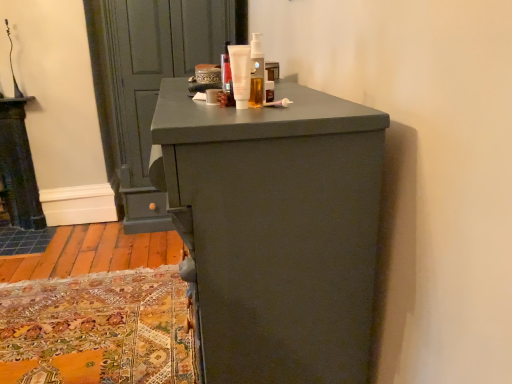
Question: Is point (239, 46) closer or farther from the camera than point (211, 99)?

Choices:
 (A) farther
 (B) closer

Answer: (B)

Question: Is white matte tube at center, positioned as the 2th toiletry in right-to-left order, inside or outside of matte white cream at center, which is counted as the first toiletry, starting from the left?

Choices:
 (A) outside
 (B) inside

Answer: (A)

Question: Estimate the real-world distances between objects in this image. Which object is farther from the matte gray door at upper left?

Choices:
 (A) white matte tube at center, acting as the 2th toiletry starting from the left
 (B) translucent plastic bottle at upper center, which is the 3th toiletry from left to right
 (C) matte gray chest of drawers at center
 (D) matte white cream at center, placed as the 3th toiletry when sorted from right to left

Answer: (A)

Question: Which is farther from the matte gray chest of drawers at center?

Choices:
 (A) white matte tube at center, acting as the 2th toiletry starting from the left
 (B) translucent plastic bottle at upper center, which is the 3th toiletry from left to right
 (C) matte white cream at center, placed as the 3th toiletry when sorted from right to left
 (D) matte gray door at upper left

Answer: (D)